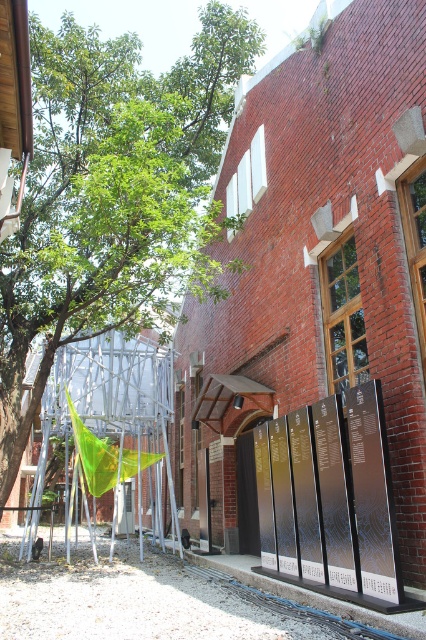
You are a visitor standing in front of the red brick building. You notice the green leafy tree at upper left and the metallic signboards at lower center. Which object takes up more space in the image?

The green leafy tree at upper left is larger in size than the metallic signboards at lower center, so it takes up more space in the image.

You are standing in front of the red brick building and see the point marked at coordinates [112,193]. What does this point indicate?

The point at coordinates [112,193] indicates the green leafy tree at upper left.

You are standing in front of the red brick building and want to walk towards the two points marked on the ground. The first point is at coordinate point (x=135, y=163) and the second is at point (x=273, y=456). Which point should you walk towards first if you want to reach the one that is closer to the building?

You should walk towards point (x=273, y=456) first because it is closer to the building than point (x=135, y=163), which is behind it.